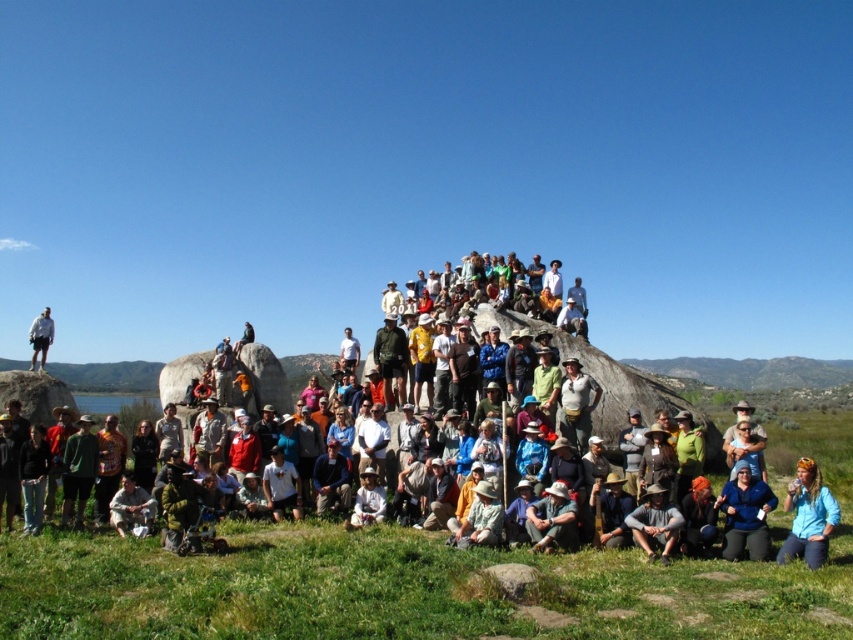
Question: Which of the following is the farthest from the observer?

Choices:
 (A) (645, 524)
 (B) (370, 518)
 (C) (821, 456)

Answer: (C)

Question: Which point is closer to the camera taking this photo?

Choices:
 (A) (567, 508)
 (B) (751, 531)
 (C) (369, 486)

Answer: (B)

Question: Is khaki cotton hat at lower center to the left of matte khaki shorts at lower left from the viewer's perspective?

Choices:
 (A) no
 (B) yes

Answer: (A)

Question: Which of the following is the closest to the observer?

Choices:
 (A) gray fabric hat at lower center
 (B) matte khaki pants at center
 (C) matte khaki shorts at lower left
 (D) blue fabric jacket at lower right

Answer: (D)

Question: Considering the relative positions of matte khaki pants at center and matte khaki shorts at lower left in the image provided, where is matte khaki pants at center located with respect to matte khaki shorts at lower left?

Choices:
 (A) left
 (B) right

Answer: (B)

Question: Does matte khaki pants at center lie behind blue fabric jacket at lower right?

Choices:
 (A) yes
 (B) no

Answer: (A)